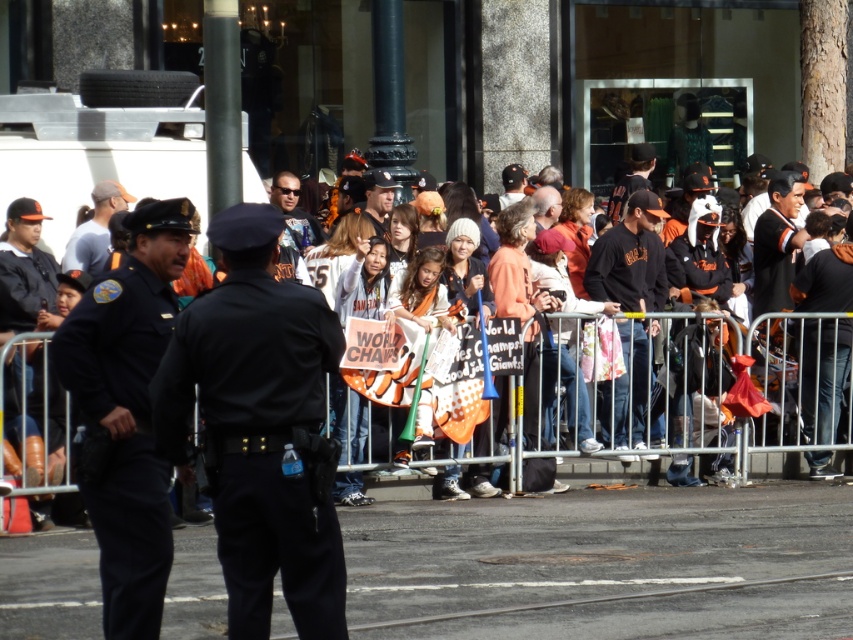
Is black uniform at center wider than silver metallic fence at center?

No.

Can you confirm if black uniform at center is thinner than silver metallic fence at center?

Correct, black uniform at center's width is less than silver metallic fence at center's.

Locate an element on the screen. Image resolution: width=853 pixels, height=640 pixels. black uniform at center is located at coordinates (258, 426).

Where is `black uniform at center`? Image resolution: width=853 pixels, height=640 pixels. black uniform at center is located at coordinates (258, 426).